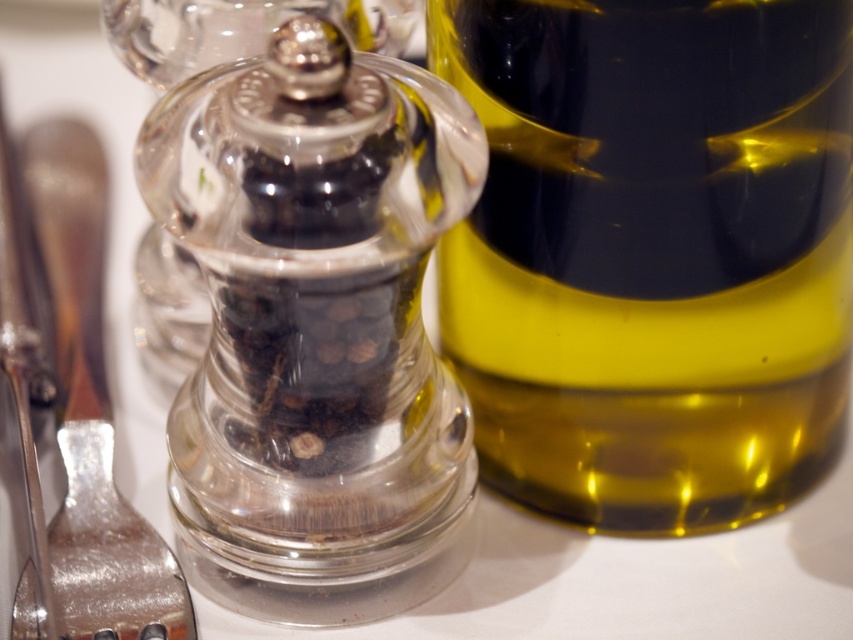
You are a chef holding a spoon and standing at the dining table. You want to sprinkle some pepper onto your dish. The transparent glass pepper mill at center is in your way. Can you reach it without moving any other objects?

The transparent glass pepper mill at center is 9.02 inches away from the viewer. Since the chef can typically reach items within this distance without moving other objects, yes, the chef can reach the transparent glass pepper mill at center.

Consider the image. You are setting up a table for a dinner party and have both the yellow translucent bottle at right and the transparent glass pepper mill at center. If you want to place them side by side on a narrow shelf that can only accommodate one item at a time, which item would you choose to fit better?

The transparent glass pepper mill at center has a smaller width compared to the yellow translucent bottle at right, so it would fit better on the narrow shelf.

You are a chef holding a measuring tape and need to determine if a 12 inch ruler can reach from your current position to the point at coordinates point (457, 84). Can the ruler reach that point?

The distance between the viewer and point (457, 84) is 11.96 inches, so yes, the 12 inch ruler can reach the point since it is slightly shorter than the ruler.